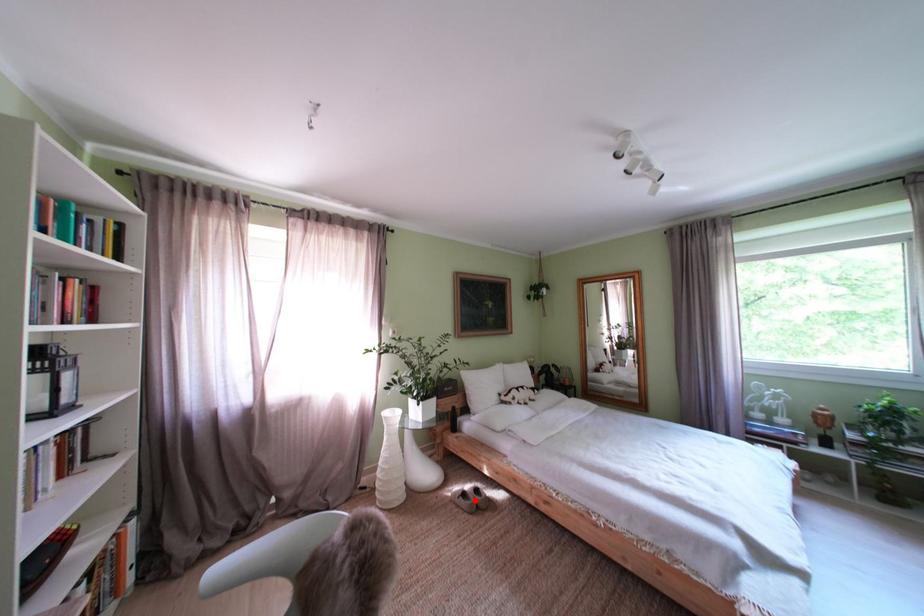
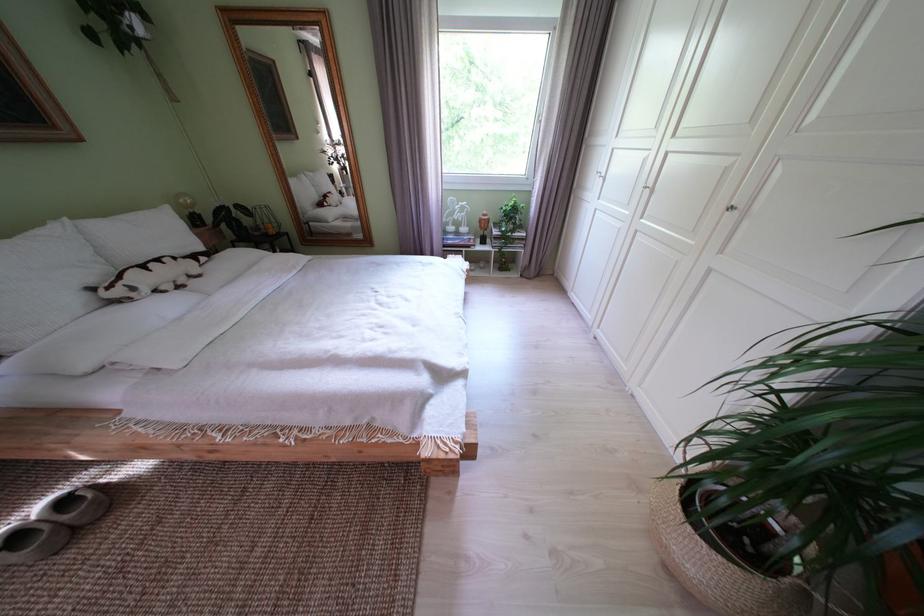
In the second image, find the point that corresponds to the highlighted location in the first image.

(28, 543)